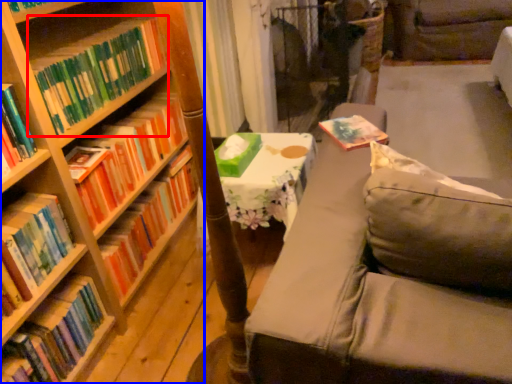
Question: Among these objects, which one is farthest to the camera, book (highlighted by a red box) or bookcase (highlighted by a blue box)?

Choices:
 (A) book
 (B) bookcase

Answer: (A)